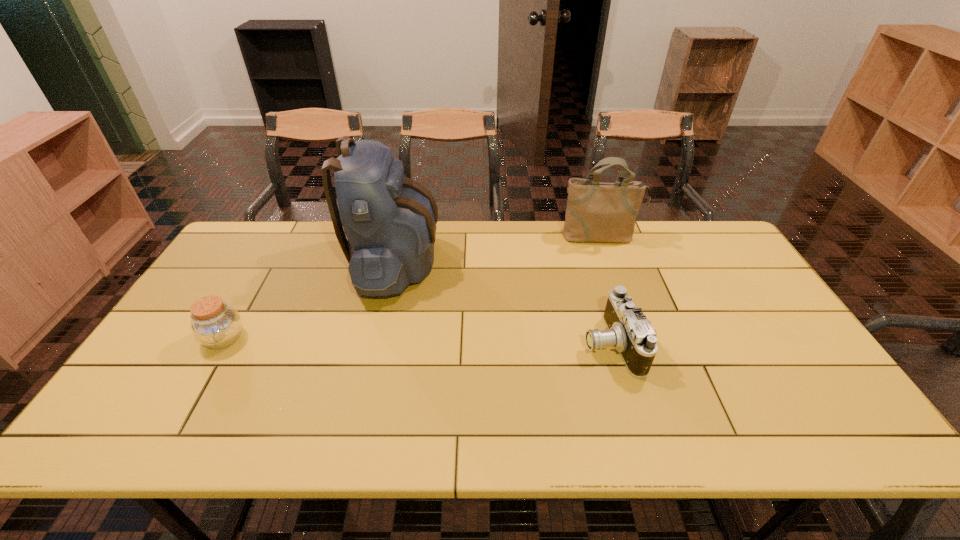
Image resolution: width=960 pixels, height=540 pixels. I want to click on the tallest object, so click(x=389, y=220).

This screenshot has width=960, height=540. I want to click on backpack, so [389, 220].

Where is `shoulder bag`? The height and width of the screenshot is (540, 960). shoulder bag is located at coordinates (596, 211).

You are a GUI agent. You are given a task and a screenshot of the screen. Output one action in this format:
    pyautogui.click(x=<x>, y=<y>)
    Task: Click on the leftmost object
    The width and height of the screenshot is (960, 540).
    Given the screenshot: What is the action you would take?
    pyautogui.click(x=215, y=324)

Locate an element on the screen. This screenshot has width=960, height=540. camera is located at coordinates (x=629, y=331).

Where is `vacant space situated at the front pocket of the backpack`? vacant space situated at the front pocket of the backpack is located at coordinates (558, 262).

The height and width of the screenshot is (540, 960). I want to click on blank space located on the front-facing side of the third shortest object, so (x=612, y=270).

Locate an element on the screen. vacant position located 0.100m on the back of the leftmost object is located at coordinates (248, 298).

Locate an element on the screen. This screenshot has width=960, height=540. free point located 0.220m at the lens of the camera is located at coordinates (499, 344).

Where is `vacant region located at the lens of the camera`? vacant region located at the lens of the camera is located at coordinates (476, 344).